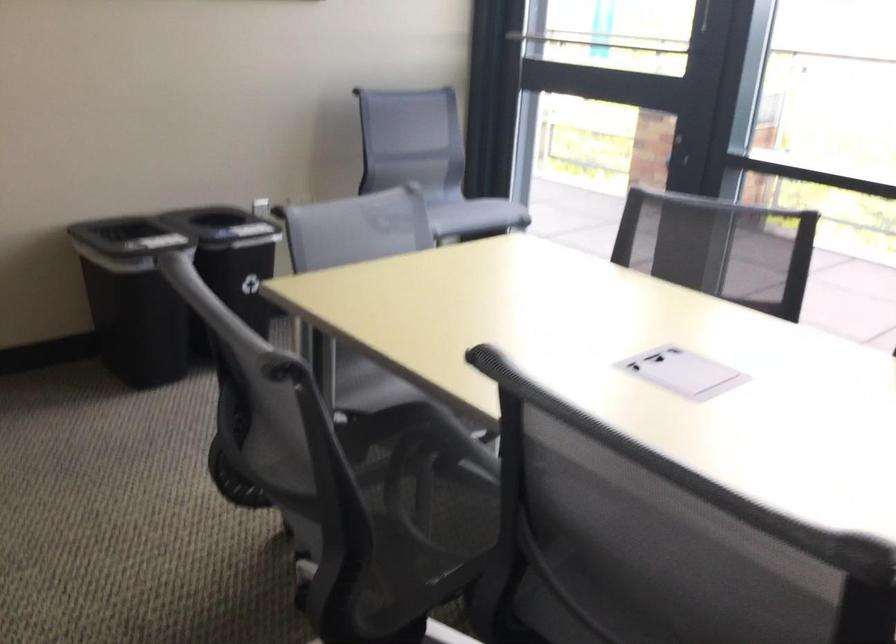
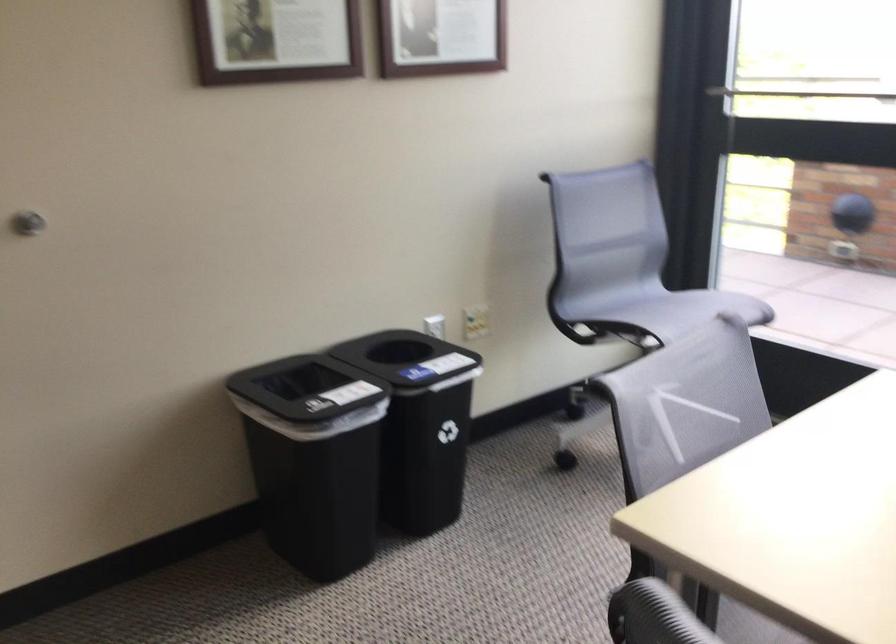
Question: The images are taken continuously from a first-person perspective. In which direction is your viewpoint rotating?

Choices:
 (A) Left
 (B) Right
 (C) Up
 (D) Down

Answer: (A)